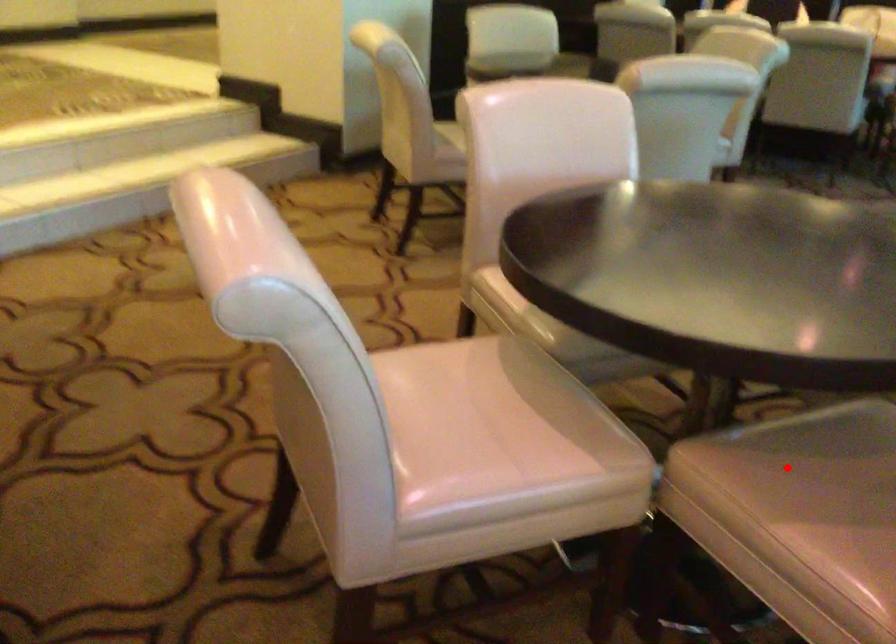
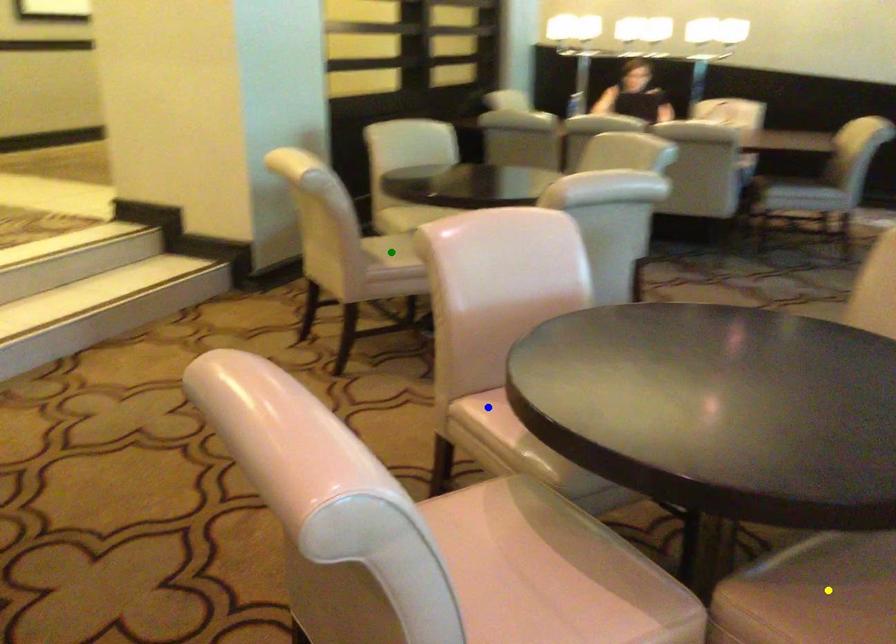
Question: I am providing you with two images of the same scene from different viewpoints. A red point is marked on the first image. You are given multiple points on the second image. In image 2, which mark is for the same physical point as the one in image 1?

Choices:
 (A) blue point
 (B) yellow point
 (C) green point

Answer: (B)